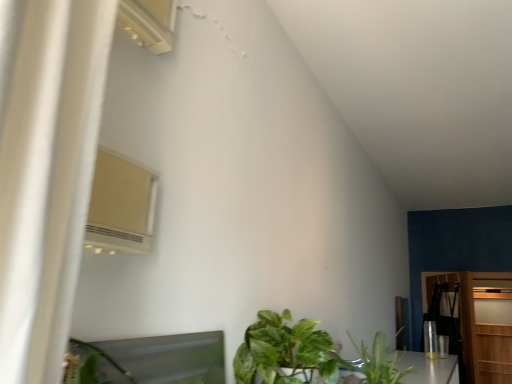
Question: Is there a large distance between wooden dresser at right and wooden door at right?

Choices:
 (A) yes
 (B) no

Answer: (B)

Question: Is wooden dresser at right smaller than wooden door at right?

Choices:
 (A) yes
 (B) no

Answer: (A)

Question: From a real-world perspective, is wooden dresser at right beneath wooden door at right?

Choices:
 (A) no
 (B) yes

Answer: (A)

Question: From the image's perspective, is wooden dresser at right over wooden door at right?

Choices:
 (A) no
 (B) yes

Answer: (B)

Question: Could you tell me if wooden dresser at right is turned towards wooden door at right?

Choices:
 (A) no
 (B) yes

Answer: (A)

Question: From a real-world perspective, is wooden dresser at right physically above wooden door at right?

Choices:
 (A) no
 (B) yes

Answer: (B)

Question: Can you confirm if white plastic air conditioner at upper left is shorter than wooden dresser at right?

Choices:
 (A) no
 (B) yes

Answer: (B)

Question: Is white plastic air conditioner at upper left aimed at wooden dresser at right?

Choices:
 (A) yes
 (B) no

Answer: (B)

Question: Is white plastic air conditioner at upper left next to wooden dresser at right and touching it?

Choices:
 (A) no
 (B) yes

Answer: (A)

Question: Is white plastic air conditioner at upper left behind wooden dresser at right?

Choices:
 (A) yes
 (B) no

Answer: (B)

Question: From the image's perspective, is white plastic air conditioner at upper left on wooden dresser at right?

Choices:
 (A) yes
 (B) no

Answer: (A)

Question: From a real-world perspective, is white plastic air conditioner at upper left located beneath wooden dresser at right?

Choices:
 (A) yes
 (B) no

Answer: (B)

Question: Considering the relative sizes of wooden dresser at right and white plastic air conditioner at upper left in the image provided, is wooden dresser at right thinner than white plastic air conditioner at upper left?

Choices:
 (A) yes
 (B) no

Answer: (B)